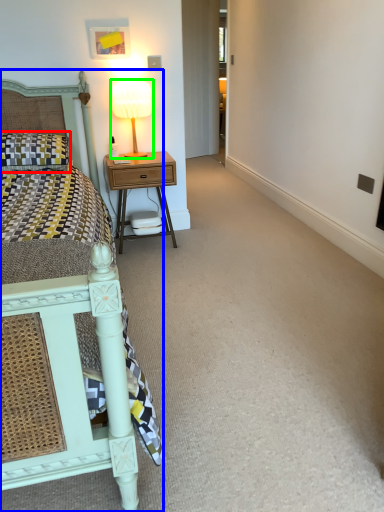
Question: Which object is positioned closest to pillow (highlighted by a red box)? Select from bed (highlighted by a blue box) and bedside lamp (highlighted by a green box).

Choices:
 (A) bed
 (B) bedside lamp

Answer: (B)